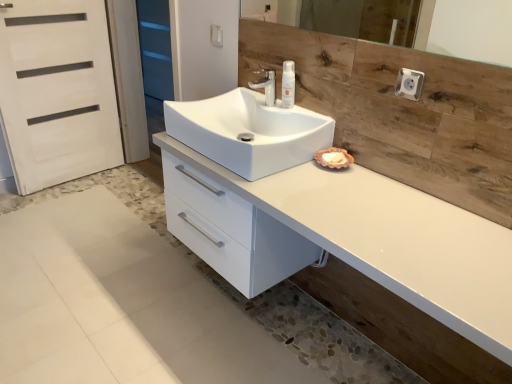
Measure the distance between matte silver faucet at center and camera.

matte silver faucet at center and camera are 5.56 feet apart from each other.

What do you see at coordinates (467, 29) in the screenshot? Image resolution: width=512 pixels, height=384 pixels. I see `wooden mirror at upper center` at bounding box center [467, 29].

The height and width of the screenshot is (384, 512). What are the coordinates of `wooden mirror at upper center` in the screenshot? It's located at (467, 29).

Image resolution: width=512 pixels, height=384 pixels. Describe the element at coordinates (409, 84) in the screenshot. I see `white plastic socket at upper right` at that location.

This screenshot has height=384, width=512. Identify the location of blue matte screen door at upper left, the 2th screen door when ordered from bottom to top. (155, 62).

The image size is (512, 384). Identify the location of white matte door at left, placed as the first screen door when sorted from front to back. (57, 91).

Is white plastic socket at upper right facing towards blue matte screen door at upper left, acting as the 2th screen door starting from the front?

No, white plastic socket at upper right is not turned towards blue matte screen door at upper left, acting as the 2th screen door starting from the front.

Are white plastic socket at upper right and blue matte screen door at upper left, which is the first screen door in top-to-bottom order, beside each other?

white plastic socket at upper right and blue matte screen door at upper left, which is the first screen door in top-to-bottom order, are clearly separated.

Which screen door is the 1st one when counting from the left side of the white plastic socket at upper right? Please provide its 2D coordinates.

[(155, 62)]

From the image's perspective, who appears lower, white plastic socket at upper right or blue matte screen door at upper left, acting as the 2th screen door starting from the front?

white plastic socket at upper right is shown below in the image.

Can you confirm if wooden mirror at upper center is shorter than matte silver faucet at center?

No.

Which is behind, point (424, 36) or point (275, 96)?

The point (424, 36) is farther from the camera.

Considering the positions of objects wooden mirror at upper center and matte silver faucet at center in the image provided, who is in front, wooden mirror at upper center or matte silver faucet at center?

wooden mirror at upper center is closer to the camera.

Is wooden mirror at upper center beside matte silver faucet at center?

No, wooden mirror at upper center is not making contact with matte silver faucet at center.

Is blue matte screen door at upper left, acting as the 2th screen door starting from the front, far from white glossy cabinet at center?

Yes, blue matte screen door at upper left, acting as the 2th screen door starting from the front, and white glossy cabinet at center are quite far apart.

Can you confirm if blue matte screen door at upper left, the 2th screen door when ordered from bottom to top, is smaller than white glossy cabinet at center?

Yes.

From a real-world perspective, between blue matte screen door at upper left, which is the first screen door in top-to-bottom order, and white glossy cabinet at center, who is vertically lower?

white glossy cabinet at center.

How far apart are blue matte screen door at upper left, acting as the 2th screen door starting from the front, and white glossy cabinet at center?

The distance of blue matte screen door at upper left, acting as the 2th screen door starting from the front, from white glossy cabinet at center is 9.70 feet.

Can you confirm if white plastic bottle at upper center is shorter than white matte door at left, the second screen door positioned from the back?

Yes, white plastic bottle at upper center is shorter than white matte door at left, the second screen door positioned from the back.

From a real-world perspective, which is physically below, white plastic bottle at upper center or white matte door at left, the first screen door positioned from the bottom?

white matte door at left, the first screen door positioned from the bottom, from a real-world perspective.

Considering the sizes of objects white plastic bottle at upper center and white matte door at left, marked as the 2th screen door in a top-to-bottom arrangement, in the image provided, who is thinner, white plastic bottle at upper center or white matte door at left, marked as the 2th screen door in a top-to-bottom arrangement,?

white plastic bottle at upper center is thinner.

Which is behind, white plastic bottle at upper center or white matte door at left, the first screen door positioned from the bottom?

white matte door at left, the first screen door positioned from the bottom, is behind.

Is white matte door at left, the first screen door positioned from the bottom, wider than white plastic bottle at upper center?

Yes.

Which is behind, white matte door at left, the first screen door positioned from the bottom, or white plastic bottle at upper center?

white matte door at left, the first screen door positioned from the bottom, is behind.

Is white matte door at left, placed as the first screen door when sorted from front to back, facing towards white plastic bottle at upper center?

Yes, white matte door at left, placed as the first screen door when sorted from front to back, faces towards white plastic bottle at upper center.

Is white plastic bottle at upper center located within white matte door at left, the second screen door positioned from the back?

No.

Between matte silver faucet at center and white glossy cabinet at center, which one appears on the right side from the viewer's perspective?

white glossy cabinet at center.

Is matte silver faucet at center oriented towards white glossy cabinet at center?

No, matte silver faucet at center is not oriented towards white glossy cabinet at center.

From a real-world perspective, which is physically below, matte silver faucet at center or white glossy cabinet at center?

white glossy cabinet at center.

Considering the sizes of objects matte silver faucet at center and white glossy cabinet at center in the image provided, who is smaller, matte silver faucet at center or white glossy cabinet at center?

Smaller between the two is matte silver faucet at center.

Is point (417, 94) in front of point (476, 31)?

Yes, point (417, 94) is in front of point (476, 31).

You are a GUI agent. You are given a task and a screenshot of the screen. Output one action in this format:
    pyautogui.click(x=<x>, y=<y>)
    Task: Click on the mirror located on the left of white plastic socket at upper right
    The height and width of the screenshot is (384, 512).
    Given the screenshot: What is the action you would take?
    pyautogui.click(x=467, y=29)

Based on the photo, is white plastic socket at upper right bigger or smaller than wooden mirror at upper center?

Clearly, white plastic socket at upper right is smaller in size than wooden mirror at upper center.

There is a white plastic socket at upper right. Where is `the 2nd screen door below it (from a real-world perspective)`? The height and width of the screenshot is (384, 512). the 2nd screen door below it (from a real-world perspective) is located at coordinates (155, 62).

This screenshot has height=384, width=512. Find the location of `mirror to the right of matte silver faucet at center`. mirror to the right of matte silver faucet at center is located at coordinates (467, 29).

Estimate the real-world distances between objects in this image. Which object is closer to white matte door at left, placed as the first screen door when sorted from front to back, white plastic socket at upper right or white glossy sink at center?

white glossy sink at center is positioned closer to the anchor white matte door at left, placed as the first screen door when sorted from front to back.

Considering their positions, is white matte door at left, the first screen door positioned from the bottom, positioned further to wooden mirror at upper center than white glossy cabinet at center?

Among the two, white matte door at left, the first screen door positioned from the bottom, is located further to wooden mirror at upper center.

When comparing their distances from blue matte screen door at upper left, which is the first screen door in top-to-bottom order, does white glossy cabinet at center or wooden mirror at upper center seem further?

The object further to blue matte screen door at upper left, which is the first screen door in top-to-bottom order, is white glossy cabinet at center.

When comparing their distances from wooden mirror at upper center, does blue matte screen door at upper left, the 2th screen door when ordered from bottom to top, or white matte door at left, placed as the first screen door when sorted from front to back, seem further?

blue matte screen door at upper left, the 2th screen door when ordered from bottom to top, is further to wooden mirror at upper center.

Looking at the image, which one is located closer to white plastic bottle at upper center, blue matte screen door at upper left, the first screen door positioned from the back, or white plastic socket at upper right?

white plastic socket at upper right is positioned closer to the anchor white plastic bottle at upper center.

Estimate the real-world distances between objects in this image. Which object is further from wooden mirror at upper center, white plastic bottle at upper center or matte silver faucet at center?

The object further to wooden mirror at upper center is matte silver faucet at center.

Estimate the real-world distances between objects in this image. Which object is further from matte silver faucet at center, wooden mirror at upper center or white glossy sink at center?

wooden mirror at upper center is positioned further to the anchor matte silver faucet at center.

When comparing their distances from white glossy cabinet at center, does white plastic bottle at upper center or white plastic socket at upper right seem closer?

Based on the image, white plastic socket at upper right appears to be nearer to white glossy cabinet at center.

The height and width of the screenshot is (384, 512). I want to click on tap between wooden mirror at upper center and white glossy cabinet at center in the up-down direction, so click(266, 85).

Identify the location of tap located between white glossy cabinet at center and blue matte screen door at upper left, which is the first screen door in top-to-bottom order, in the depth direction. The width and height of the screenshot is (512, 384). (266, 85).

The height and width of the screenshot is (384, 512). Find the location of `tap located between white glossy sink at center and white plastic socket at upper right in the left-right direction`. tap located between white glossy sink at center and white plastic socket at upper right in the left-right direction is located at coordinates (266, 85).

Image resolution: width=512 pixels, height=384 pixels. I want to click on mirror located between white matte door at left, marked as the 2th screen door in a top-to-bottom arrangement, and white plastic socket at upper right in the left-right direction, so click(x=467, y=29).